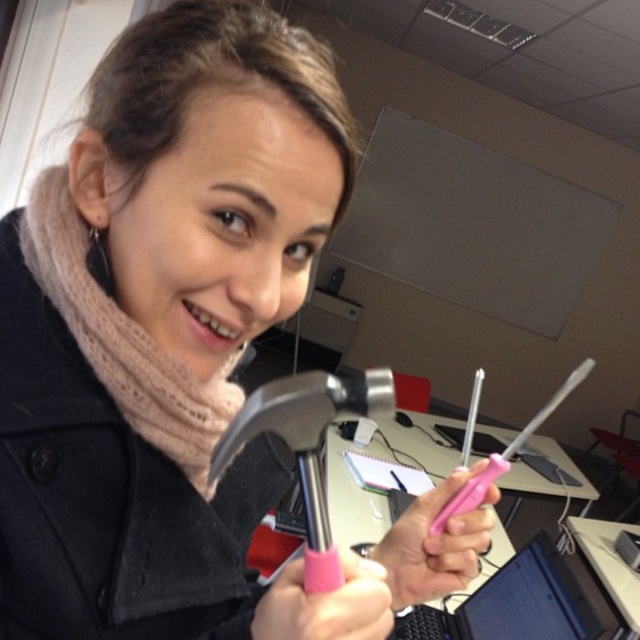
You are standing in an office and see two points marked on the floor. The first point is labeled as point (x=33, y=200) and the second is labeled as point (x=371, y=564). If you are facing north, which point is closer to you?

Point (x=33, y=200) is behind point (x=371, y=564), so if you are facing north, point (x=371, y=564) is closer to you.

You are organizing tools in an office supply closet and need to place the brushed metal hammer at center and the pink plastic screwdriver at lower center on a shelf. The shelf has a space that is exactly 1.8 inches wide. Can both items fit side by side on the shelf without overlapping?

The brushed metal hammer at center is 1.85 inches away from the pink plastic screwdriver at lower center. Since the required space is 1.85 inches and the shelf space is only 1.8 inches, the two items cannot fit side by side on the shelf without overlapping.

You are organizing a tool kit and need to place the brushed metal hammer at center and the pink plastic screwdriver at lower center into a drawer. The drawer has a maximum capacity of 15 cm in height. If the combined height of both items is 20 cm, will they fit together?

The combined height of the brushed metal hammer at center and the pink plastic screwdriver at lower center is 20 cm, which exceeds the drawer capacity of 15 cm. Therefore, they cannot fit together.